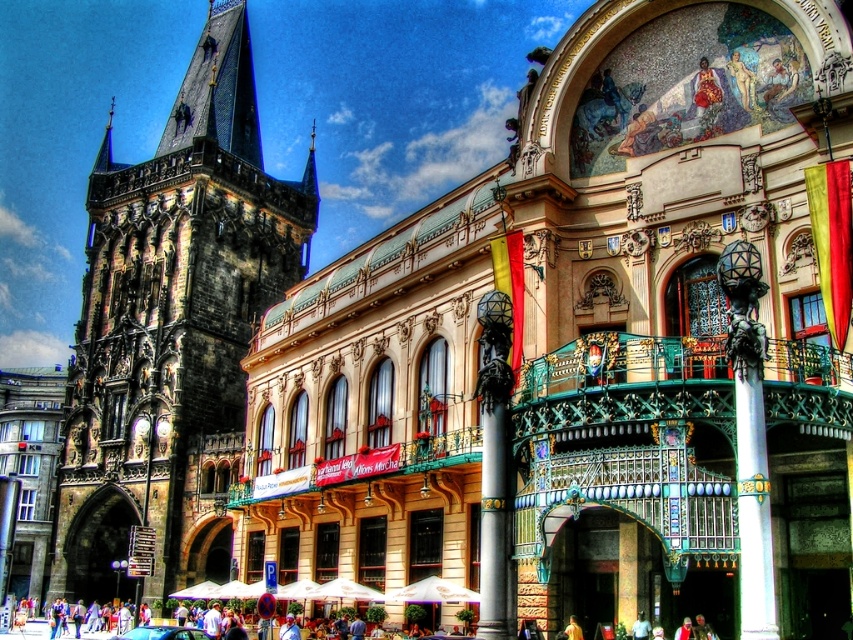
Can you confirm if dark stone tower at left is wider than metallic blue car at center?

Yes, dark stone tower at left is wider than metallic blue car at center.

Can you confirm if dark stone tower at left is positioned to the right of metallic blue car at center?

Incorrect, dark stone tower at left is not on the right side of metallic blue car at center.

The width and height of the screenshot is (853, 640). What do you see at coordinates (172, 328) in the screenshot? I see `dark stone tower at left` at bounding box center [172, 328].

Where is `dark stone tower at left`? This screenshot has height=640, width=853. dark stone tower at left is located at coordinates (172, 328).